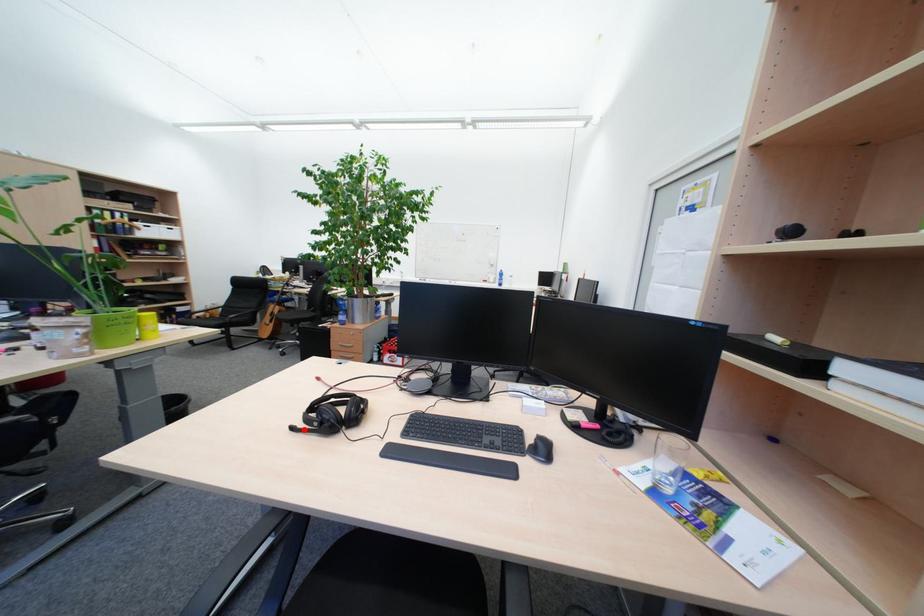
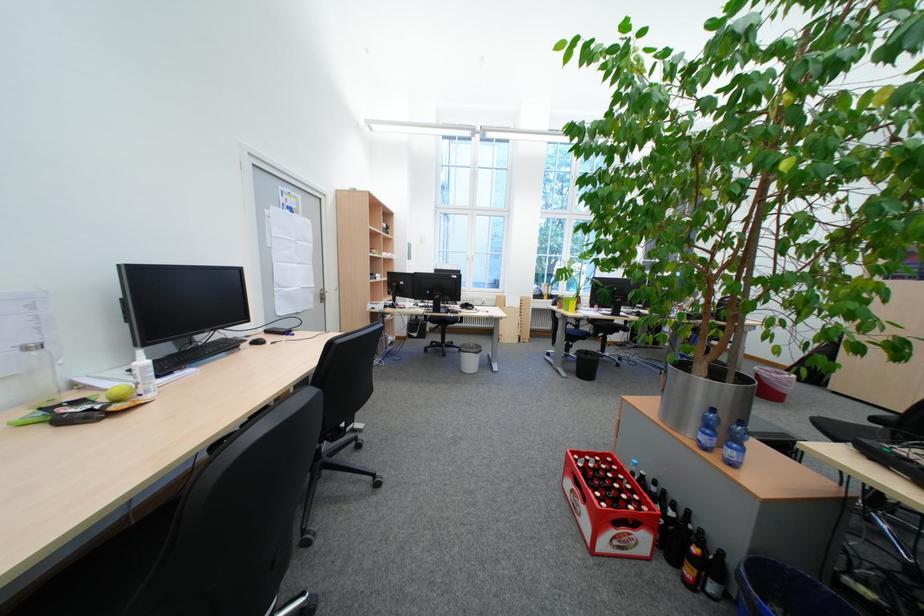
Question: I am providing you with two images of the same scene from different viewpoints. A red point is marked on the first image. Is the red point's position out of view in image 2?

Choices:
 (A) Yes
 (B) No

Answer: (A)